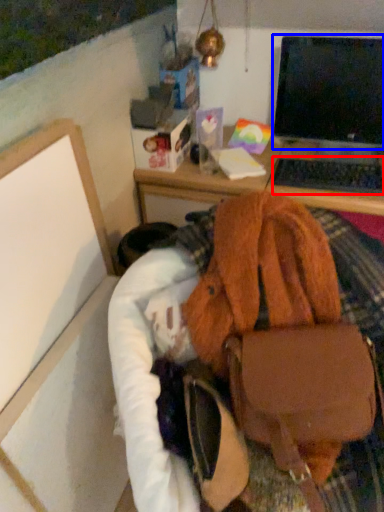
Question: Among these objects, which one is nearest to the camera, computer keyboard (highlighted by a red box) or computer monitor (highlighted by a blue box)?

Choices:
 (A) computer keyboard
 (B) computer monitor

Answer: (B)